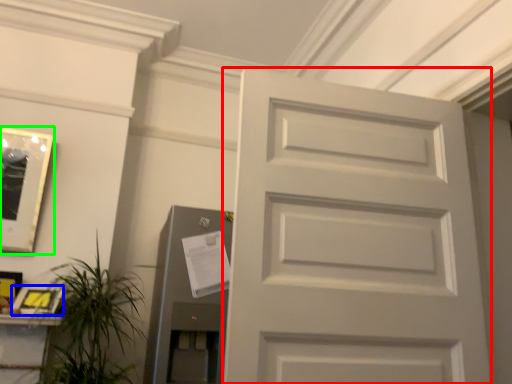
Question: Which object is positioned closest to door (highlighted by a red box)? Select from picture frame (highlighted by a blue box) and picture frame (highlighted by a green box).

Choices:
 (A) picture frame
 (B) picture frame

Answer: (A)